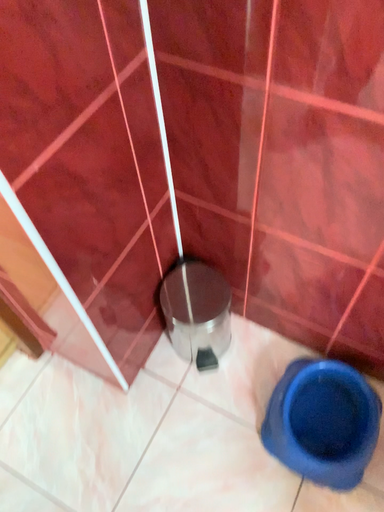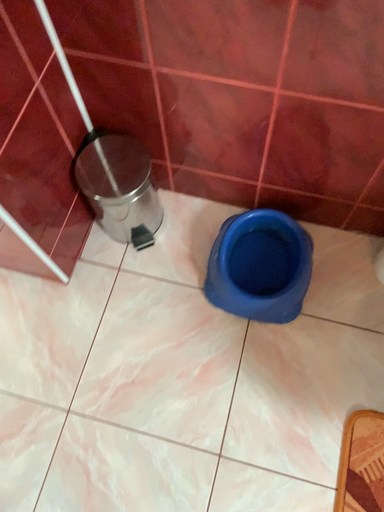
Question: Which way did the camera rotate in the video?

Choices:
 (A) rotated right
 (B) rotated left

Answer: (A)